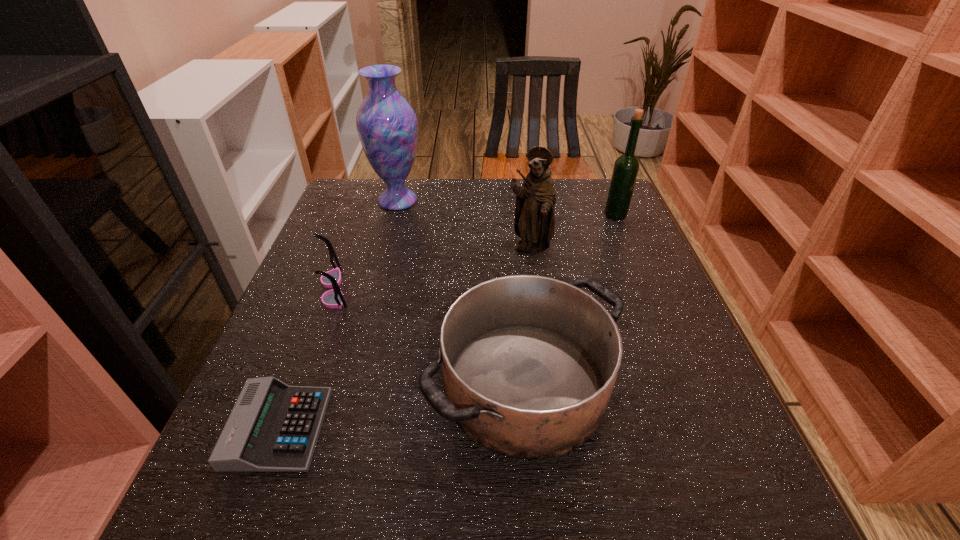
This screenshot has height=540, width=960. In the image, there is a desktop. Identify the location of vacant region at the far right corner. (567, 188).

Locate an element on the screen. free space between the tallest object and the third nearest object is located at coordinates (366, 245).

In order to click on free space that is in between the second shortest object and the saucepan in this screenshot , I will do `click(430, 338)`.

Locate an element on the screen. free spot between the liquor and the spectacles is located at coordinates 475,252.

This screenshot has width=960, height=540. What are the coordinates of `free point between the vase and the figurine` in the screenshot? It's located at (464, 226).

You are a GUI agent. You are given a task and a screenshot of the screen. Output one action in this format:
    pyautogui.click(x=<x>, y=<y>)
    Task: Click on the vacant area between the saucepan and the calculator
    
    Given the screenshot: What is the action you would take?
    pyautogui.click(x=402, y=407)

Locate an element on the screen. free spot between the figurine and the calculator is located at coordinates pyautogui.click(x=404, y=339).

Identify the location of free point between the second shortest object and the tallest object. (366, 245).

Locate an element on the screen. This screenshot has width=960, height=540. the fifth closest object relative to the rightmost object is located at coordinates (273, 427).

Locate which object is the fifth closest to the figurine. Please provide its 2D coordinates. Your answer should be formatted as a tuple, i.e. [(x, y)], where the tuple contains the x and y coordinates of a point satisfying the conditions above.

[(273, 427)]